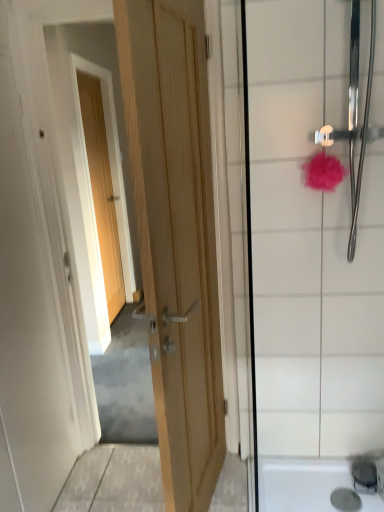
Question: Considering the relative sizes of pink fluffy sponge at upper right and light wood door at upper left, placed as the 2th door when sorted from front to back, in the image provided, is pink fluffy sponge at upper right taller than light wood door at upper left, placed as the 2th door when sorted from front to back,?

Choices:
 (A) yes
 (B) no

Answer: (B)

Question: Does pink fluffy sponge at upper right have a lesser height compared to light wood door at upper left, placed as the 2th door when sorted from front to back?

Choices:
 (A) no
 (B) yes

Answer: (B)

Question: Considering the relative positions of pink fluffy sponge at upper right and light wood door at upper left, arranged as the 1th door when viewed from the left, in the image provided, is pink fluffy sponge at upper right to the right of light wood door at upper left, arranged as the 1th door when viewed from the left, from the viewer's perspective?

Choices:
 (A) no
 (B) yes

Answer: (B)

Question: Is the depth of pink fluffy sponge at upper right greater than that of light wood door at upper left, arranged as the 1th door when viewed from the left?

Choices:
 (A) no
 (B) yes

Answer: (A)

Question: Can you confirm if pink fluffy sponge at upper right is smaller than light wood door at upper left, arranged as the 1th door when viewed from the left?

Choices:
 (A) yes
 (B) no

Answer: (B)

Question: Is light wood door at upper left, arranged as the 1th door when viewed from the left, in front of or behind pink fluffy bath puff at upper right in the image?

Choices:
 (A) front
 (B) behind

Answer: (B)

Question: Looking at their shapes, would you say light wood door at upper left, arranged as the 1th door when viewed from the left, is wider or thinner than pink fluffy bath puff at upper right?

Choices:
 (A) thin
 (B) wide

Answer: (A)

Question: Is light wood door at upper left, arranged as the 1th door when viewed from the left, bigger or smaller than pink fluffy bath puff at upper right?

Choices:
 (A) big
 (B) small

Answer: (A)

Question: Does point (94, 164) appear closer or farther from the camera than point (321, 173)?

Choices:
 (A) farther
 (B) closer

Answer: (A)

Question: From the image's perspective, is white glossy shower door at right positioned above or below pink fluffy bath puff at upper right?

Choices:
 (A) below
 (B) above

Answer: (A)

Question: In terms of size, does white glossy shower door at right appear bigger or smaller than pink fluffy bath puff at upper right?

Choices:
 (A) big
 (B) small

Answer: (A)

Question: Is white glossy shower door at right wider or thinner than pink fluffy bath puff at upper right?

Choices:
 (A) wide
 (B) thin

Answer: (B)

Question: From a real-world perspective, relative to pink fluffy bath puff at upper right, is white glossy shower door at right vertically above or below?

Choices:
 (A) below
 (B) above

Answer: (A)

Question: Choose the correct answer: Is wooden door at center, arranged as the first door when viewed from the front, inside light wood door at upper left, which is counted as the second door, starting from the right, or outside it?

Choices:
 (A) inside
 (B) outside

Answer: (B)

Question: From a real-world perspective, relative to light wood door at upper left, placed as the 2th door when sorted from front to back, is wooden door at center, arranged as the 1th door when viewed from the right, vertically above or below?

Choices:
 (A) above
 (B) below

Answer: (B)